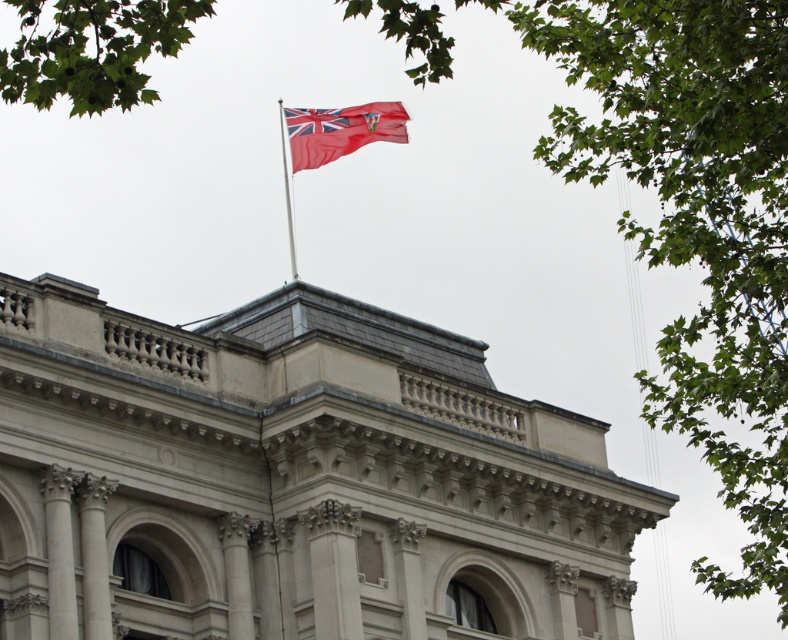
You are standing in front of the classical building and want to hang a new flag. The flag you have is slightly larger than the red fabric flag at upper center. If you want to hang it on the silver metallic flag pole at upper center, will it block the view of the flag pole?

The red fabric flag at upper center is closer to the viewer than the silver metallic flag pole at upper center. Since the new flag is larger and placed in front of the pole, it would likely block the view of the silver metallic flag pole at upper center.

You are an architect reviewing the design of a classical building. You notice the red fabric flag at upper center and the silver metallic flag pole at upper center. According to the design, which object is positioned higher?

The red fabric flag at upper center is positioned higher than the silver metallic flag pole at upper center as stated in the description.